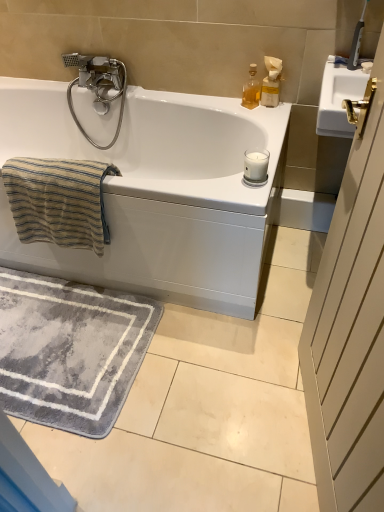
The width and height of the screenshot is (384, 512). I want to click on vacant space to the left of translucent glass bottle at upper right, which appears as the 2th soap dispenser when viewed from the right, so click(221, 105).